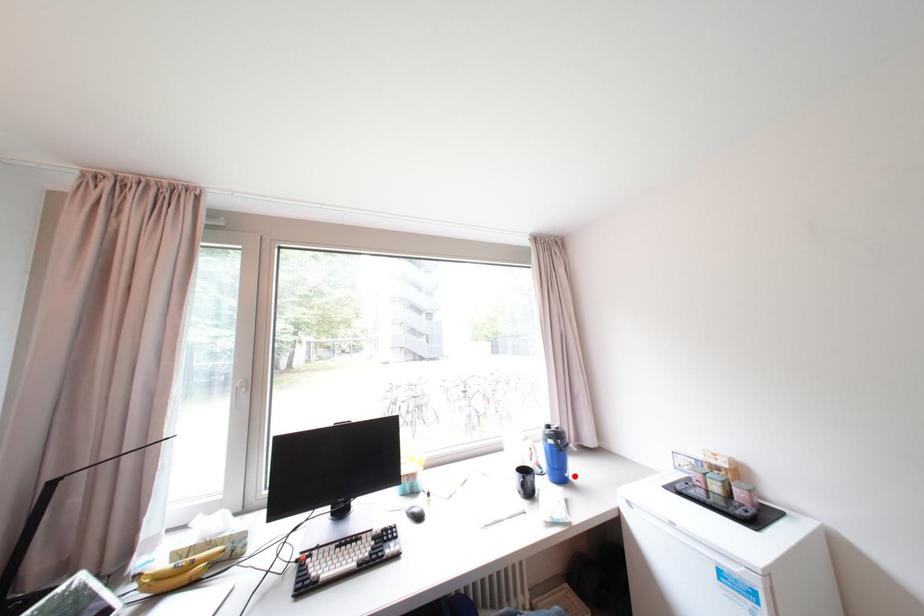
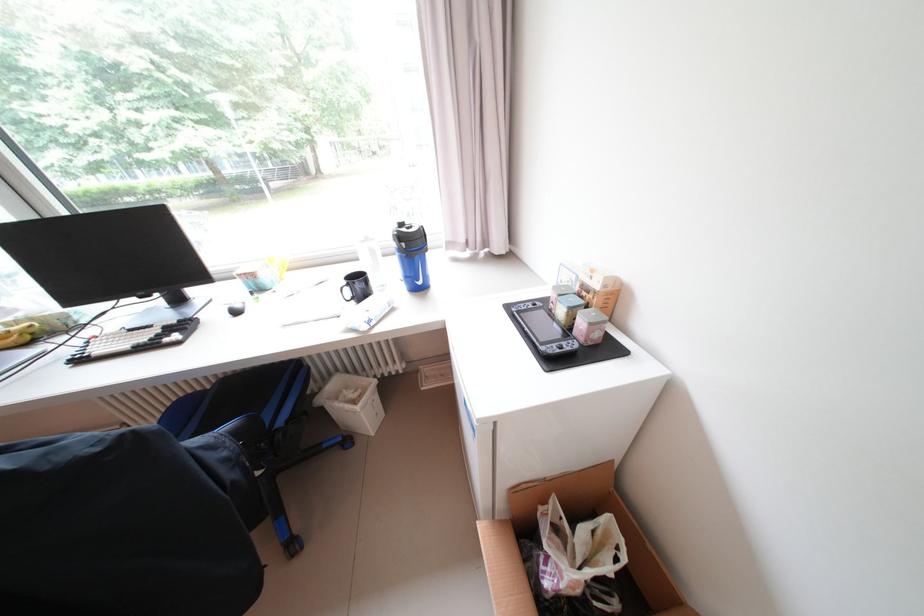
The point at the highlighted location is marked in the first image. Where is the corresponding point in the second image?

(428, 284)